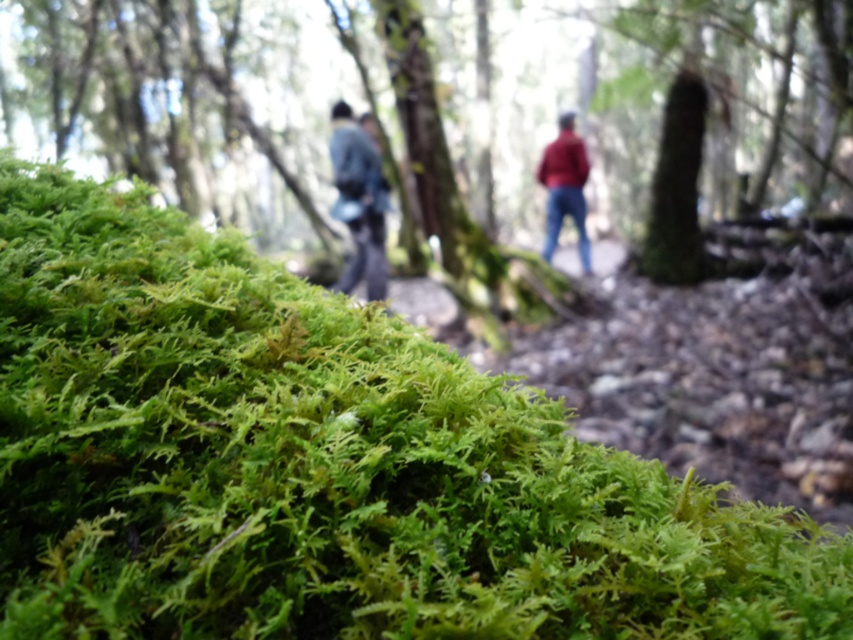
Consider the image. Can you confirm if green mossy rock at lower left is positioned to the right of dark blue jacket at center?

No, green mossy rock at lower left is not to the right of dark blue jacket at center.

Can you confirm if green mossy rock at lower left is positioned above dark blue jacket at center?

Indeed, green mossy rock at lower left is positioned over dark blue jacket at center.

Which is in front, point (680, 218) or point (347, 268)?

Point (347, 268) is in front.

Find the location of a particular element. Image resolution: width=853 pixels, height=640 pixels. green mossy rock at lower left is located at coordinates (448, 116).

Is dark blue jacket at center smaller than matte red jacket at center?

Correct, dark blue jacket at center occupies less space than matte red jacket at center.

Which is above, dark blue jacket at center or matte red jacket at center?

matte red jacket at center is higher up.

This screenshot has width=853, height=640. Describe the element at coordinates (358, 202) in the screenshot. I see `dark blue jacket at center` at that location.

You are a GUI agent. You are given a task and a screenshot of the screen. Output one action in this format:
    pyautogui.click(x=<x>, y=<y>)
    Task: Click on the dark blue jacket at center
    
    Given the screenshot: What is the action you would take?
    pyautogui.click(x=358, y=202)

Is green mossy rock at lower left shorter than denim jacket at center?

In fact, green mossy rock at lower left may be taller than denim jacket at center.

In order to click on green mossy rock at lower left in this screenshot , I will do `click(448, 116)`.